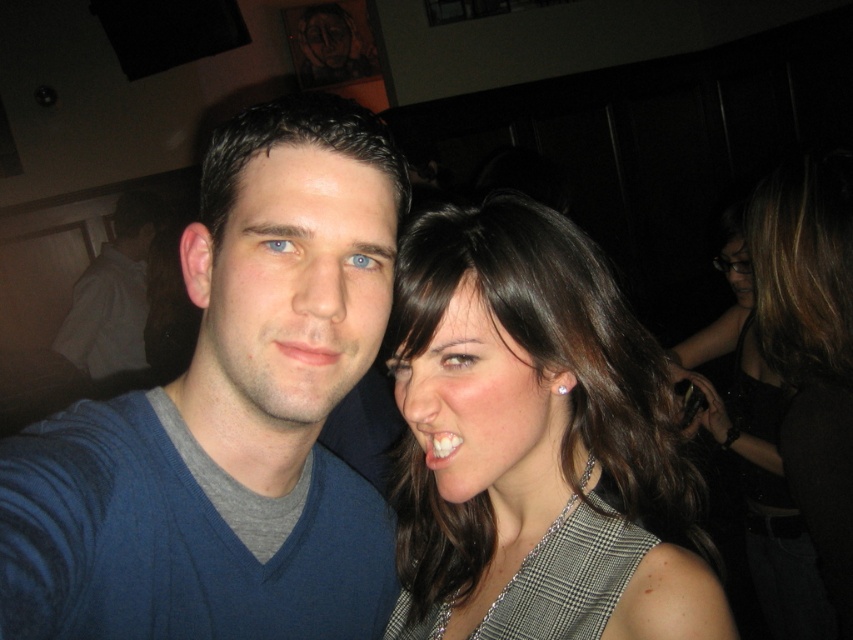
Based on the photo, you are a photographer at a party and need to decide which dress to feature in your photo. The plaid fabric dress at right and the shiny black dress at right are both options. Based on their widths, which dress would allow for a wider frame in the photo?

The shiny black dress at right has a greater width than the plaid fabric dress at right, so it would allow for a wider frame in the photo.